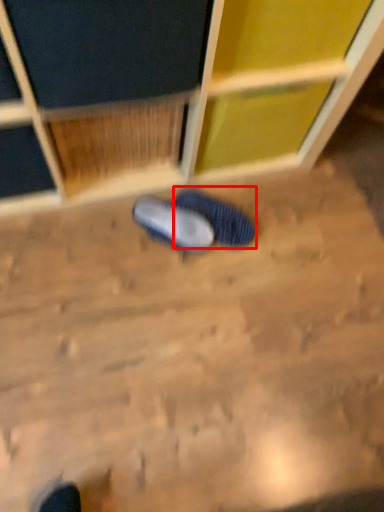
Question: From the image's perspective, what is the correct spatial positioning of footwear (annotated by the red box) in reference to footwear?

Choices:
 (A) above
 (B) below

Answer: (A)